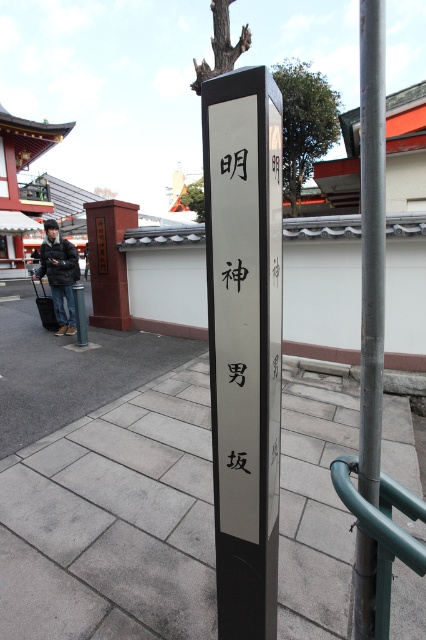
Question: Based on their relative distances, which object is nearer to the white glossy signpost at center?

Choices:
 (A) metallic gray pole at center right
 (B) gray concrete pavement at center
 (C) matte black signpost at lower left

Answer: (A)

Question: Among these points, which one is nearest to the camera?

Choices:
 (A) (247, 506)
 (B) (77, 296)

Answer: (A)

Question: Which point is closer to the camera?

Choices:
 (A) (37, 353)
 (B) (80, 317)

Answer: (A)

Question: Does gray concrete pavement at center come in front of metallic gray pole at center right?

Choices:
 (A) no
 (B) yes

Answer: (A)

Question: Does brick signpost at center appear on the right side of matte black signpost at lower left?

Choices:
 (A) no
 (B) yes

Answer: (B)

Question: Is gray concrete pavement at center positioned in front of matte black signpost at lower left?

Choices:
 (A) no
 (B) yes

Answer: (B)